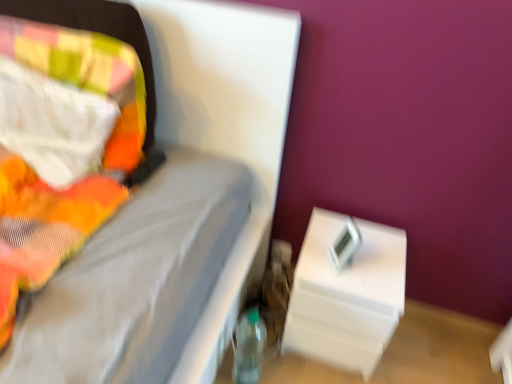
Question: Is white plastic nightstand at lower right directly adjacent to fluffy multicolored pillow at left?

Choices:
 (A) no
 (B) yes

Answer: (A)

Question: From the image's perspective, is white plastic nightstand at lower right below fluffy multicolored pillow at left?

Choices:
 (A) no
 (B) yes

Answer: (B)

Question: Can you confirm if white plastic nightstand at lower right is shorter than fluffy multicolored pillow at left?

Choices:
 (A) yes
 (B) no

Answer: (B)

Question: Is white plastic nightstand at lower right at the right side of fluffy multicolored pillow at left?

Choices:
 (A) no
 (B) yes

Answer: (B)

Question: From a real-world perspective, is white plastic nightstand at lower right on top of fluffy multicolored pillow at left?

Choices:
 (A) yes
 (B) no

Answer: (B)

Question: Considering the relative positions of white plastic nightstand at lower right and fluffy multicolored pillow at left in the image provided, is white plastic nightstand at lower right to the left of fluffy multicolored pillow at left from the viewer's perspective?

Choices:
 (A) yes
 (B) no

Answer: (B)

Question: Is white plastic nightstand at lower right surrounded by fluffy multicolored pillow at left?

Choices:
 (A) yes
 (B) no

Answer: (B)

Question: Would you say fluffy multicolored pillow at left is outside white plastic nightstand at lower right?

Choices:
 (A) yes
 (B) no

Answer: (A)

Question: Does fluffy multicolored pillow at left turn towards white plastic nightstand at lower right?

Choices:
 (A) yes
 (B) no

Answer: (B)

Question: Is the position of fluffy multicolored pillow at left less distant than that of white plastic nightstand at lower right?

Choices:
 (A) no
 (B) yes

Answer: (B)

Question: From a real-world perspective, is fluffy multicolored pillow at left on top of white plastic nightstand at lower right?

Choices:
 (A) no
 (B) yes

Answer: (B)

Question: From the image's perspective, is fluffy multicolored pillow at left on white plastic nightstand at lower right?

Choices:
 (A) no
 (B) yes

Answer: (B)

Question: Could you tell me if white plastic nightstand at lower right is facing transparent plastic bottle at lower center?

Choices:
 (A) no
 (B) yes

Answer: (A)